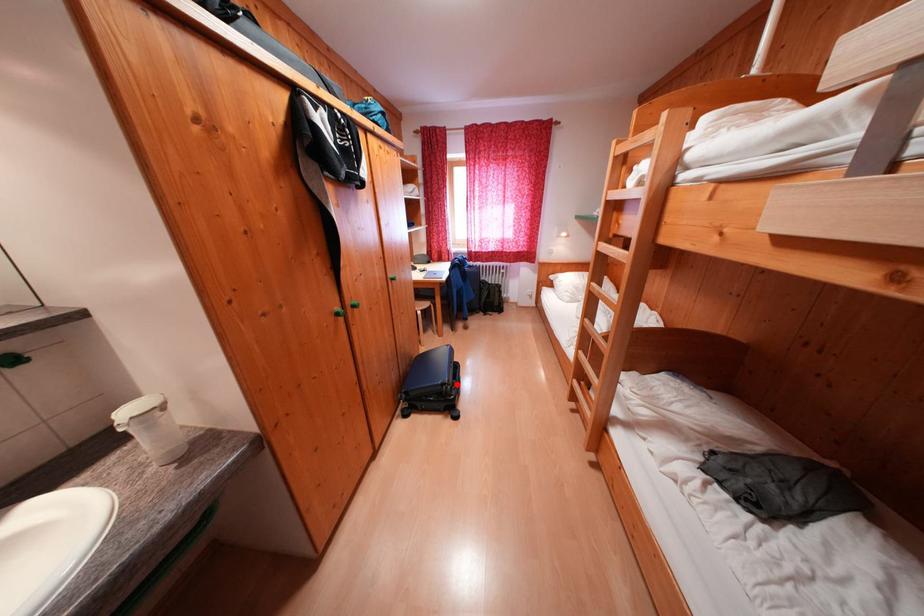
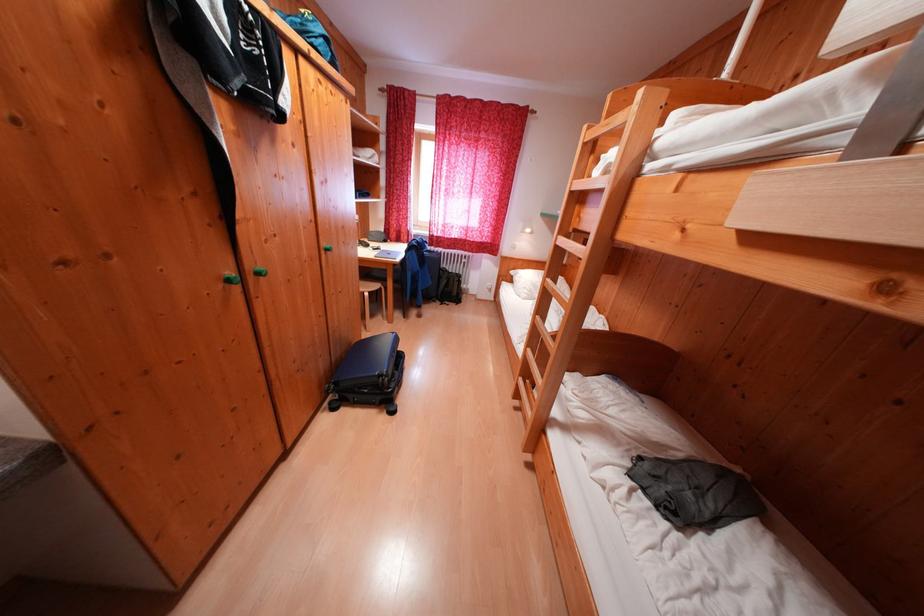
The point at the highlighted location is marked in the first image. Where is the corresponding point in the second image?

(395, 376)